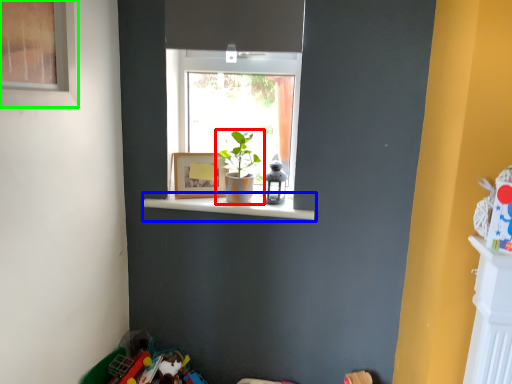
Question: Based on their relative distances, which object is nearer to houseplant (highlighted by a red box)? Choose from window sill (highlighted by a blue box) and window (highlighted by a green box).

Choices:
 (A) window sill
 (B) window

Answer: (A)